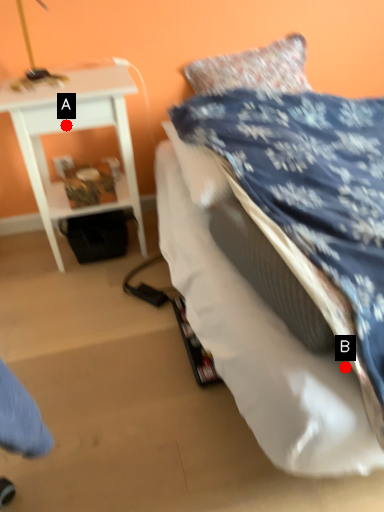
Question: Two points are circled on the image, labeled by A and B beside each circle. Which of the following is the closest to the observer?

Choices:
 (A) A is closer
 (B) B is closer

Answer: (B)